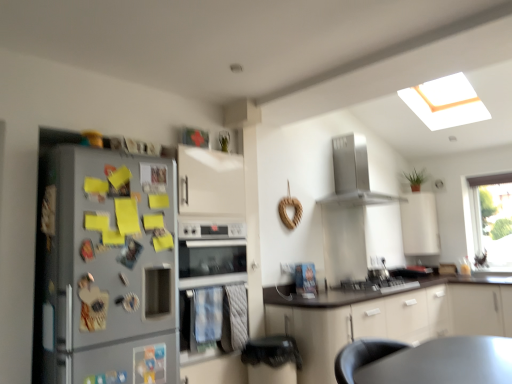
Question: Looking at their shapes, would you say satin silver range hood at upper center is wider or thinner than satin silver gas stove at center?

Choices:
 (A) wide
 (B) thin

Answer: (B)

Question: Based on their sizes in the image, would you say satin silver range hood at upper center is bigger or smaller than satin silver gas stove at center?

Choices:
 (A) big
 (B) small

Answer: (A)

Question: Which is nearer to the white matte cabinet at center, which appears as the second cabinetry when viewed from the back?

Choices:
 (A) white matte cabinet at upper right, the 1th cabinetry when ordered from top to bottom
 (B) silver metallic refrigerator at left
 (C) satin silver range hood at upper center
 (D) silver metallic oven at center
 (E) transparent glass window at upper right

Answer: (D)

Question: Estimate the real-world distances between objects in this image. Which object is farther from the white matte cabinet at upper right, the 1th cabinetry when ordered from top to bottom?

Choices:
 (A) silver metallic oven at center
 (B) white matte cabinet at center, which appears as the second cabinetry when viewed from the back
 (C) transparent glass window at upper right
 (D) satin silver range hood at upper center
 (E) silver metallic refrigerator at left

Answer: (E)